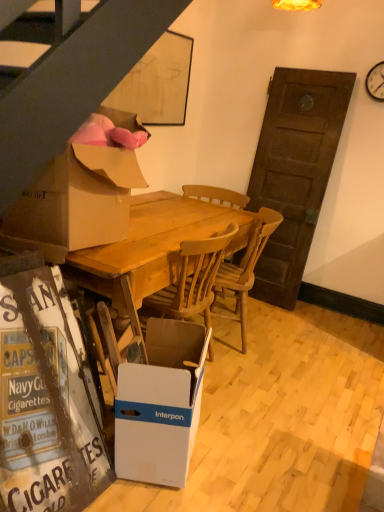
Question: Could you tell me if wooden chair at center is facing wooden table at center?

Choices:
 (A) yes
 (B) no

Answer: (B)

Question: Is wooden chair at center thinner than wooden table at center?

Choices:
 (A) no
 (B) yes

Answer: (B)

Question: Can you confirm if wooden chair at center is taller than wooden table at center?

Choices:
 (A) no
 (B) yes

Answer: (A)

Question: Does wooden chair at center lie behind wooden table at center?

Choices:
 (A) yes
 (B) no

Answer: (A)

Question: From a real-world perspective, is wooden chair at center located beneath wooden table at center?

Choices:
 (A) yes
 (B) no

Answer: (A)

Question: Is wooden chair at center looking in the opposite direction of wooden table at center?

Choices:
 (A) no
 (B) yes

Answer: (A)

Question: Is white cardboard box at lower center, acting as the first box starting from the bottom, placed right next to cardboard box at left, the 2th box from the bottom?

Choices:
 (A) yes
 (B) no

Answer: (B)

Question: Is white cardboard box at lower center, the 2th box positioned from the top, smaller than cardboard box at left, the 1th box in the top-to-bottom sequence?

Choices:
 (A) no
 (B) yes

Answer: (B)

Question: From a real-world perspective, does white cardboard box at lower center, the 2th box positioned from the top, stand above cardboard box at left, the 2th box from the bottom?

Choices:
 (A) no
 (B) yes

Answer: (A)

Question: Is white cardboard box at lower center, acting as the first box starting from the bottom, shorter than cardboard box at left, the 1th box in the top-to-bottom sequence?

Choices:
 (A) no
 (B) yes

Answer: (B)

Question: Considering the relative positions of white cardboard box at lower center, the 2th box positioned from the top, and cardboard box at left, the 2th box from the bottom, in the image provided, is white cardboard box at lower center, the 2th box positioned from the top, behind cardboard box at left, the 2th box from the bottom,?

Choices:
 (A) yes
 (B) no

Answer: (A)

Question: Is white cardboard box at lower center, the 2th box positioned from the top, positioned before cardboard box at left, the 1th box in the top-to-bottom sequence?

Choices:
 (A) yes
 (B) no

Answer: (B)

Question: Considering the relative sizes of wooden chair at center and cardboard box at left, the 1th box in the top-to-bottom sequence, in the image provided, is wooden chair at center taller than cardboard box at left, the 1th box in the top-to-bottom sequence,?

Choices:
 (A) no
 (B) yes

Answer: (B)